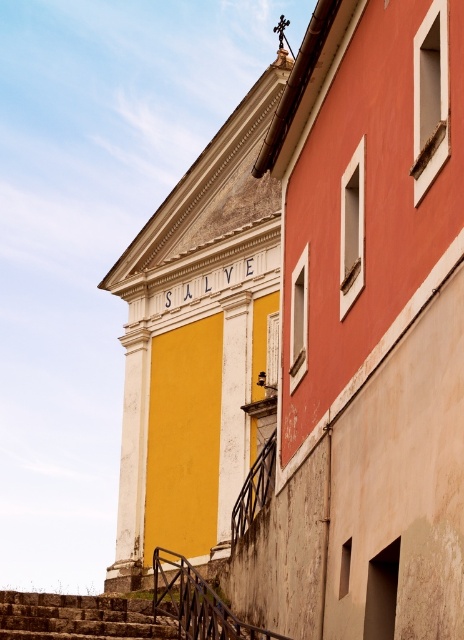
Based on the photo, does stone stairs at lower left appear on the left side of black metal railing at lower center?

Indeed, stone stairs at lower left is positioned on the left side of black metal railing at lower center.

Who is higher up, stone stairs at lower left or black metal railing at lower center?

black metal railing at lower center is above.

Locate an element on the screen. This screenshot has height=640, width=464. stone stairs at lower left is located at coordinates (78, 618).

Is stone stairs at lower left thinner than black wrought iron railing at lower center?

No.

Can you confirm if stone stairs at lower left is wider than black wrought iron railing at lower center?

Correct, the width of stone stairs at lower left exceeds that of black wrought iron railing at lower center.

Measure the distance between stone stairs at lower left and camera.

stone stairs at lower left is 48.86 meters from camera.

Identify the location of stone stairs at lower left. The image size is (464, 640). (78, 618).

Based on the photo, does black metal railing at lower center appear under black wrought iron railing at lower center?

Yes.

Is black metal railing at lower center positioned at the back of black wrought iron railing at lower center?

No, black metal railing at lower center is closer to the viewer.

Identify the location of black metal railing at lower center. This screenshot has width=464, height=640. (195, 602).

At what (x,y) coordinates should I click in order to perform the action: click on black metal railing at lower center. Please return your answer as a coordinate pair (x, y). The height and width of the screenshot is (640, 464). Looking at the image, I should click on (195, 602).